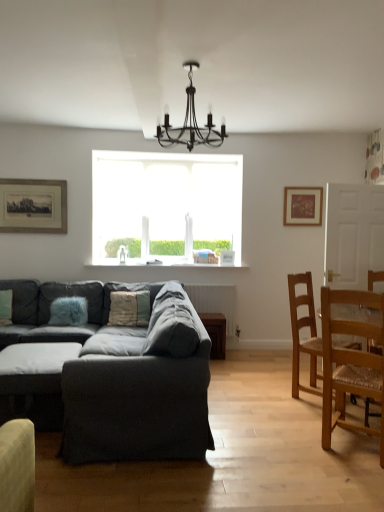
Image resolution: width=384 pixels, height=512 pixels. I want to click on vacant area on top of black metal chandelier at upper center (from a real-world perspective), so click(200, 59).